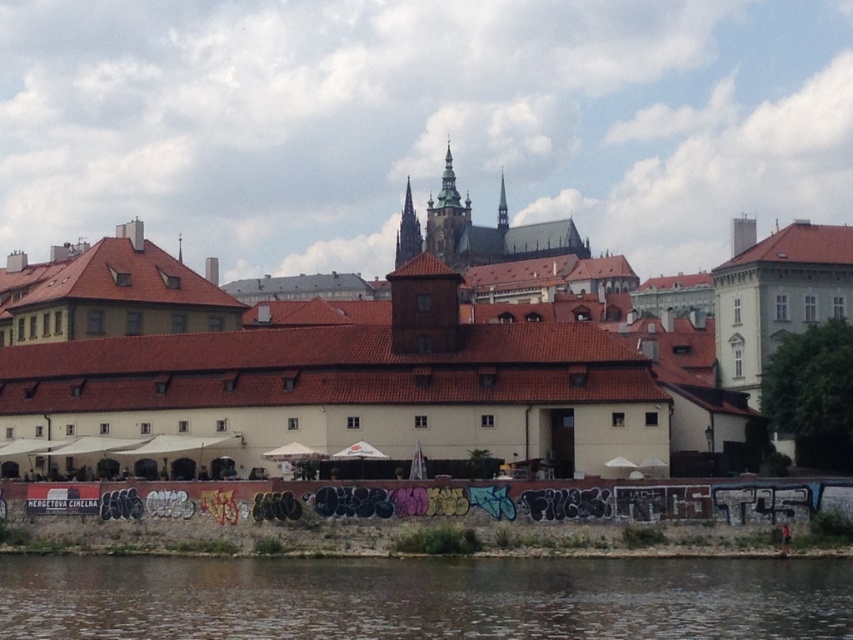
Is point (753, 316) farther from viewer compared to point (537, 582)?

That is True.

Does white matte building at center have a smaller size compared to brown water at lower center?

Actually, white matte building at center might be larger than brown water at lower center.

The height and width of the screenshot is (640, 853). What do you see at coordinates (405, 362) in the screenshot?
I see `white matte building at center` at bounding box center [405, 362].

Identify the location of white matte building at center. (405, 362).

Which of these two, brown water at lower center or concrete wall with graffiti at lower center, stands taller?

With more height is concrete wall with graffiti at lower center.

Is brown water at lower center further to the viewer compared to concrete wall with graffiti at lower center?

No, it is in front of concrete wall with graffiti at lower center.

Who is more forward, (239, 589) or (268, 497)?

Point (239, 589) is more forward.

Find the location of `brown water at lower center`. brown water at lower center is located at coordinates [422, 596].

Can you confirm if white matte building at center is positioned to the left of concrete wall with graffiti at lower center?

Incorrect, white matte building at center is not on the left side of concrete wall with graffiti at lower center.

Which of these two, white matte building at center or concrete wall with graffiti at lower center, stands shorter?

concrete wall with graffiti at lower center

Between point (148, 336) and point (111, 524), which one is positioned behind?

The point (148, 336) is behind.

Where is `white matte building at center`? The width and height of the screenshot is (853, 640). white matte building at center is located at coordinates (405, 362).